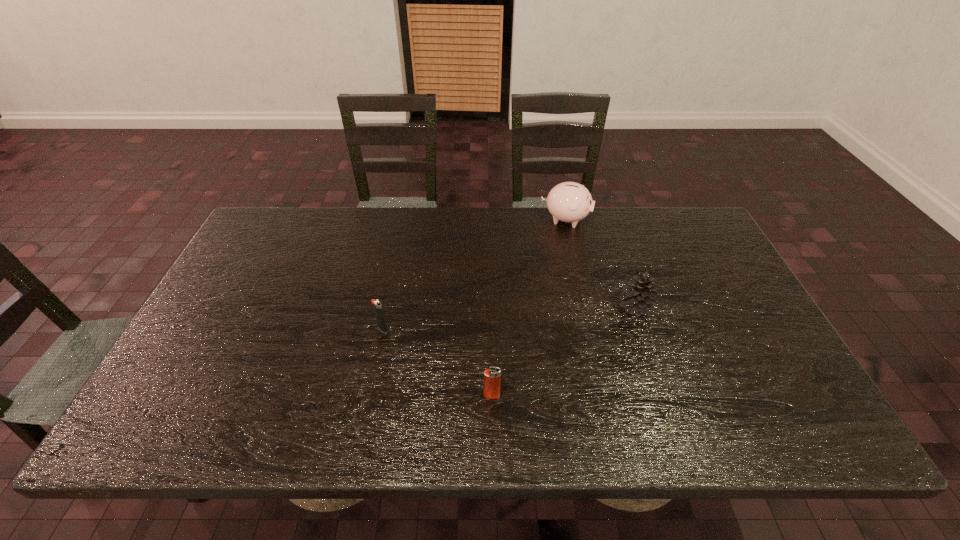
Where is `the third object from left to right`? the third object from left to right is located at coordinates (570, 202).

Find the location of a particular element. The image size is (960, 540). the farthest object is located at coordinates (570, 202).

Identify the location of the rightmost object. click(638, 296).

Find the location of a particular element. The height and width of the screenshot is (540, 960). the third nearest object is located at coordinates (638, 296).

What are the coordinates of `the leftmost object` in the screenshot? It's located at (378, 311).

I want to click on the third farthest object, so click(x=378, y=311).

The height and width of the screenshot is (540, 960). In order to click on the nearest object in this screenshot , I will do `click(492, 377)`.

The image size is (960, 540). I want to click on the right igniter, so click(492, 377).

Where is `vacant space positioned 0.400m on the front of the third object from left to right`? vacant space positioned 0.400m on the front of the third object from left to right is located at coordinates (591, 328).

What are the coordinates of `vacant region located on the left of the rightmost object` in the screenshot? It's located at (489, 307).